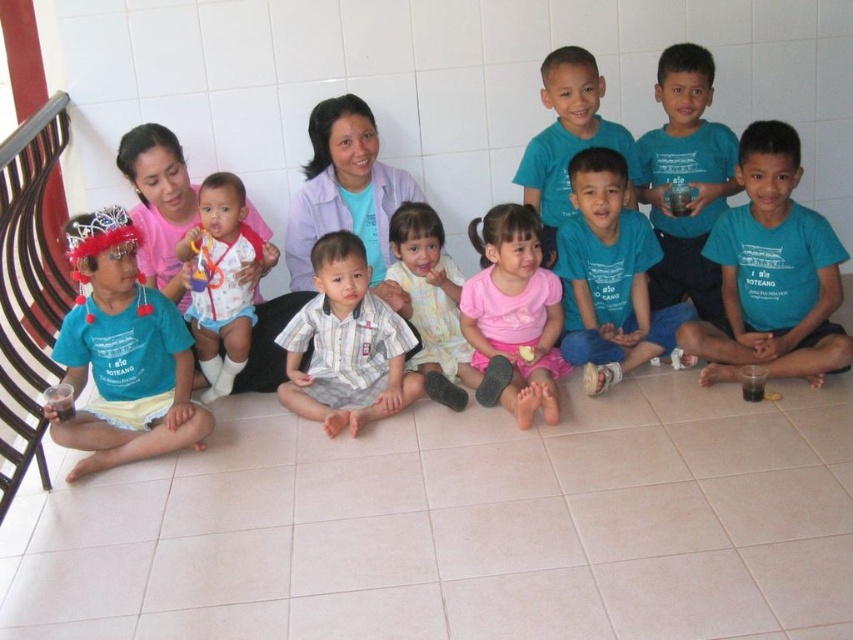
You are organizing a clothing donation drive and need to stack items vertically. You have a striped cotton shirt at center and a pink fabric dress at center. Which item should you place on top to ensure the stack remains stable?

The striped cotton shirt at center is positioned under the pink fabric dress at center, so to ensure stability, place the pink fabric dress at center on top of the striped cotton shirt at center.

You are organizing a clothing donation drive and need to sort shirts by size. You have a blue cotton shirt at center and a teal matte shirt at center. Which shirt should you place in the small size bin?

The blue cotton shirt at center is smaller than the teal matte shirt at center, so it should be placed in the small size bin.

You are organizing a clothing donation drive and need to determine which of the two shirts, the blue cotton shirt at center or the teal matte shirt at center, can fit into a storage box that requires items to be no wider than 14 inches. According to the description, which shirt is more likely to fit?

The teal matte shirt at center is more likely to fit into the storage box because the blue cotton shirt at center might be wider than it, potentially exceeding the 14 inches width requirement.